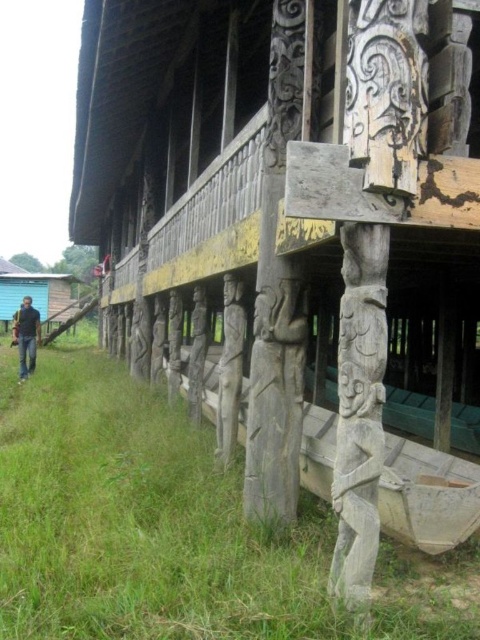
Who is more forward, [101,545] or [454,509]?

Positioned in front is point [101,545].

Is point (128, 556) more distant than point (458, 538)?

No.

Where is `green grass at lower center`? The width and height of the screenshot is (480, 640). green grass at lower center is located at coordinates (171, 528).

Is wooden canoe at lower center taller than dark blue jeans at lower left?

In fact, wooden canoe at lower center may be shorter than dark blue jeans at lower left.

Who is positioned more to the left, wooden canoe at lower center or dark blue jeans at lower left?

dark blue jeans at lower left is more to the left.

Is point (334, 412) less distant than point (23, 368)?

That is True.

At what (x,y) coordinates should I click in order to perform the action: click on wooden canoe at lower center. Please return your answer as a coordinate pair (x, y). This screenshot has width=480, height=640. Looking at the image, I should click on (427, 496).

Between weathered wood hut at lower center and dark blue jeans at lower left, which one appears on the left side from the viewer's perspective?

Positioned to the left is dark blue jeans at lower left.

Does weathered wood hut at lower center appear on the right side of dark blue jeans at lower left?

Indeed, weathered wood hut at lower center is positioned on the right side of dark blue jeans at lower left.

Which is in front, point (337, 323) or point (34, 348)?

Point (34, 348)

The height and width of the screenshot is (640, 480). In order to click on weathered wood hut at lower center in this screenshot , I will do `click(297, 230)`.